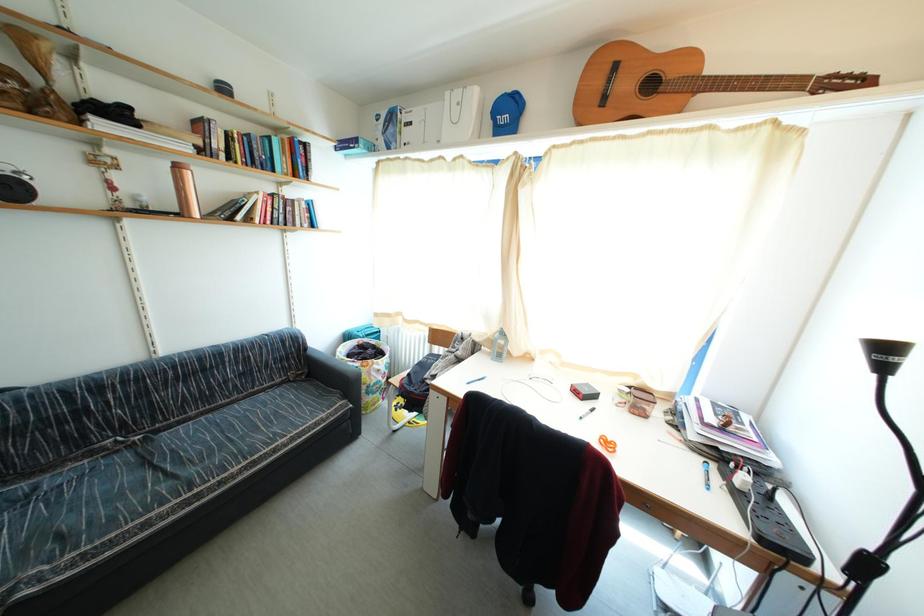
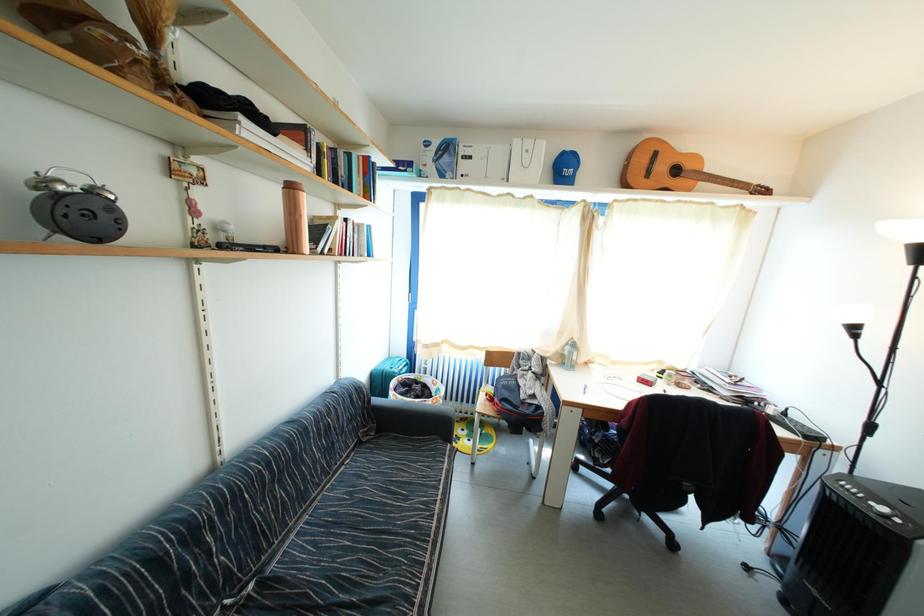
Question: Which direction would the cameraman need to move to produce the second image? Reply with the corresponding letter.

Choices:
 (A) Left
 (B) Right
 (C) Forward
 (D) Backward

Answer: (A)